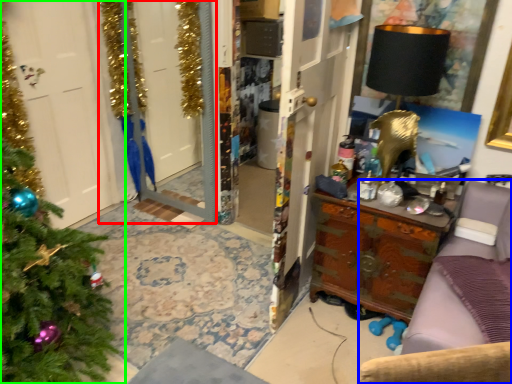
Question: Estimate the real-world distances between objects in this image. Which object is closer to screen door (highlighted by a red box), furniture (highlighted by a blue box) or christmas tree (highlighted by a green box)?

Choices:
 (A) furniture
 (B) christmas tree

Answer: (B)